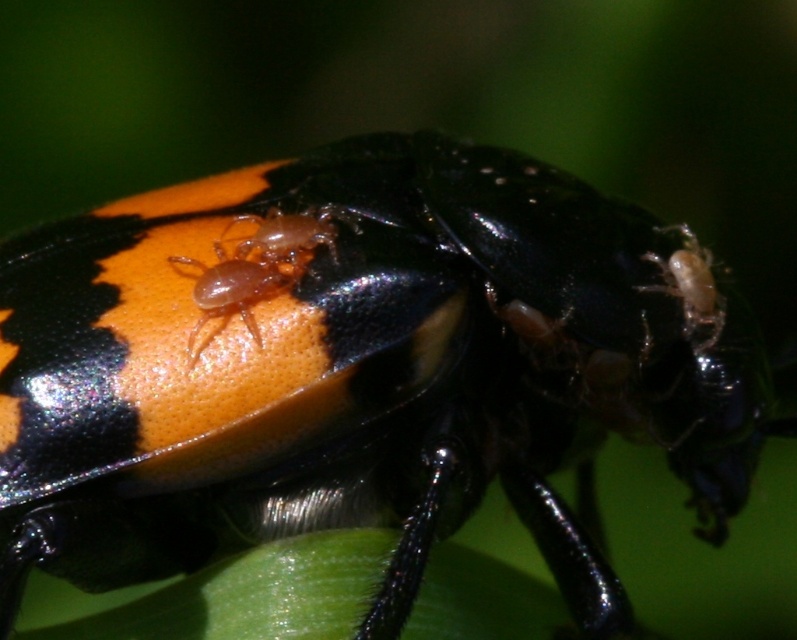
Can you confirm if translucent orange spider at center is smaller than translucent beige spider at upper right?

Actually, translucent orange spider at center might be larger than translucent beige spider at upper right.

Is translucent orange spider at center further to camera compared to translucent beige spider at upper right?

No, it is in front of translucent beige spider at upper right.

Find the location of a particular element. Image resolution: width=797 pixels, height=640 pixels. translucent orange spider at center is located at coordinates [260, 262].